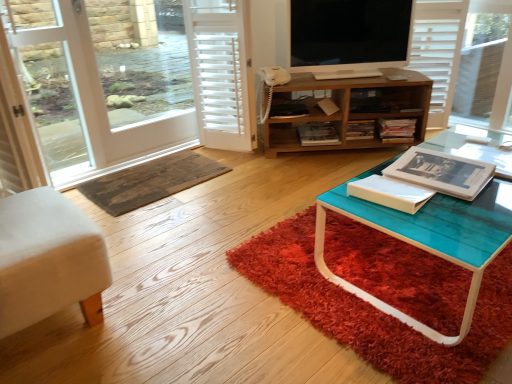
Question: Can you confirm if black glossy tv at upper center is smaller than transparent glass screen door at left?

Choices:
 (A) yes
 (B) no

Answer: (A)

Question: Does black glossy tv at upper center come behind transparent glass screen door at left?

Choices:
 (A) no
 (B) yes

Answer: (B)

Question: Can you confirm if black glossy tv at upper center is positioned to the left of transparent glass screen door at left?

Choices:
 (A) no
 (B) yes

Answer: (A)

Question: From a real-world perspective, is black glossy tv at upper center on transparent glass screen door at left?

Choices:
 (A) no
 (B) yes

Answer: (B)

Question: Is black glossy tv at upper center beside transparent glass screen door at left?

Choices:
 (A) yes
 (B) no

Answer: (B)

Question: Does black glossy tv at upper center have a greater height compared to transparent glass screen door at left?

Choices:
 (A) no
 (B) yes

Answer: (A)

Question: From the image's perspective, would you say white fabric cushion at lower left is positioned over shaggy red rug at lower center, the second doormat from the left?

Choices:
 (A) no
 (B) yes

Answer: (A)

Question: Is white fabric cushion at lower left oriented away from shaggy red rug at lower center, which is counted as the 2th doormat, starting from the back?

Choices:
 (A) no
 (B) yes

Answer: (A)

Question: Considering the relative positions of white fabric cushion at lower left and shaggy red rug at lower center, marked as the first doormat in a front-to-back arrangement, in the image provided, is white fabric cushion at lower left in front of shaggy red rug at lower center, marked as the first doormat in a front-to-back arrangement,?

Choices:
 (A) no
 (B) yes

Answer: (B)

Question: Is white fabric cushion at lower left bigger than shaggy red rug at lower center, which is counted as the 2th doormat, starting from the back?

Choices:
 (A) no
 (B) yes

Answer: (B)

Question: Is white fabric cushion at lower left far from shaggy red rug at lower center, the second doormat from the left?

Choices:
 (A) no
 (B) yes

Answer: (A)

Question: Is white fabric cushion at lower left directly adjacent to shaggy red rug at lower center, which is counted as the 2th doormat, starting from the back?

Choices:
 (A) yes
 (B) no

Answer: (B)

Question: Is transparent glass screen door at left shorter than wooden cabinet at center?

Choices:
 (A) no
 (B) yes

Answer: (A)